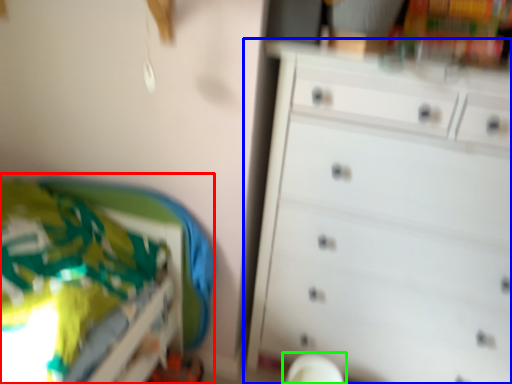
Question: Which object is the farthest from bed (highlighted by a red box)? Choose among these: chest of drawers (highlighted by a blue box) or swivel chair (highlighted by a green box).

Choices:
 (A) chest of drawers
 (B) swivel chair

Answer: (B)